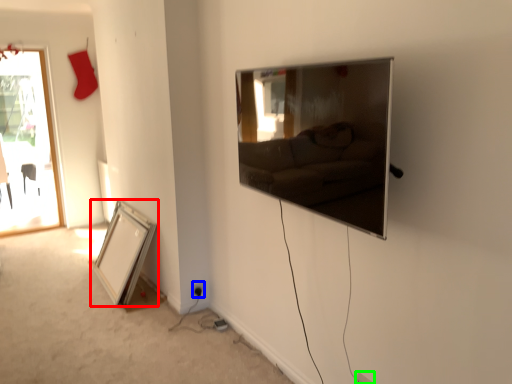
Question: Which object is positioned farthest from picture frame (highlighted by a red box)? Select from electric outlet (highlighted by a blue box) and electric outlet (highlighted by a green box).

Choices:
 (A) electric outlet
 (B) electric outlet

Answer: (B)